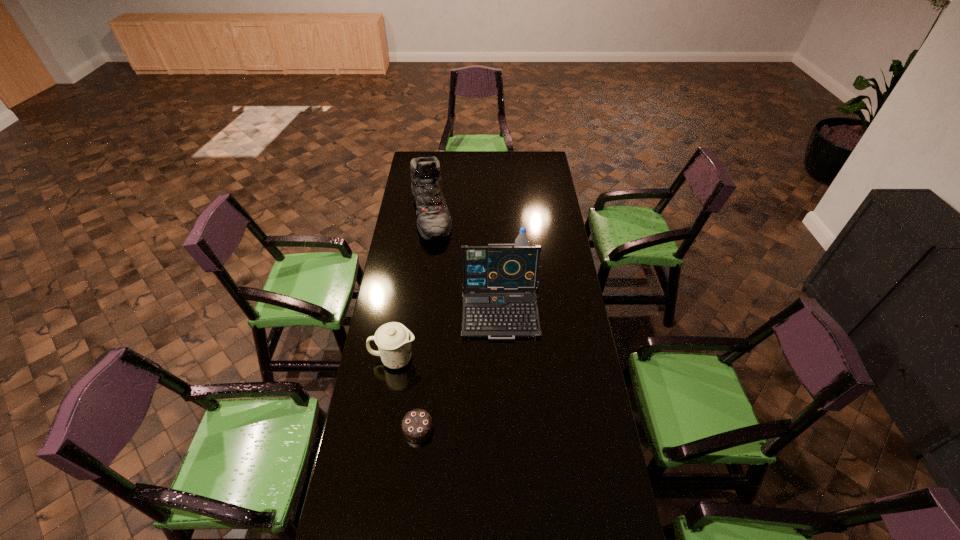
This screenshot has height=540, width=960. Identify the location of the farthest object. (434, 223).

Identify the location of laptop computer. The image size is (960, 540). (497, 267).

You are a GUI agent. You are given a task and a screenshot of the screen. Output one action in this format:
    pyautogui.click(x=<x>, y=<y>)
    Task: Click on the fourth farthest object
    
    Given the screenshot: What is the action you would take?
    pyautogui.click(x=393, y=339)

Find the location of a particular element. the second farthest object is located at coordinates pos(522,240).

Image resolution: width=960 pixels, height=540 pixels. What are the coordinates of `the nearest object` in the screenshot? It's located at (417, 425).

This screenshot has width=960, height=540. In order to click on the shortest object in this screenshot , I will do `click(417, 425)`.

The image size is (960, 540). Identify the location of free space located 0.140m on the right of the farthest object. (479, 215).

Where is `vacant space located on the front-facing side of the third nearest object`? Image resolution: width=960 pixels, height=540 pixels. vacant space located on the front-facing side of the third nearest object is located at coordinates (507, 383).

Where is `vacant space located 0.190m on the spout of the chinaware`? vacant space located 0.190m on the spout of the chinaware is located at coordinates (467, 359).

Find the location of a particular element. This screenshot has height=540, width=960. vacant space located 0.060m on the left of the bottle is located at coordinates (501, 255).